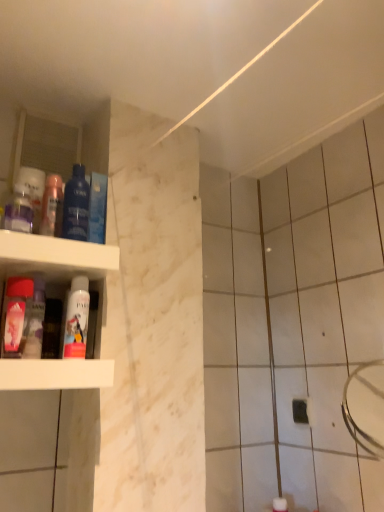
Question: Are translucent plastic mouthwash at upper left, the third mouthwash positioned from the left, and pink matte spray can at lower left, acting as the 2th mouthwash starting from the right, located far from each other?

Choices:
 (A) no
 (B) yes

Answer: (A)

Question: Considering the relative sizes of translucent plastic mouthwash at upper left, placed as the fourth mouthwash when sorted from right to left, and pink matte spray can at lower left, acting as the 2th mouthwash starting from the right, in the image provided, is translucent plastic mouthwash at upper left, placed as the fourth mouthwash when sorted from right to left, smaller than pink matte spray can at lower left, acting as the 2th mouthwash starting from the right,?

Choices:
 (A) yes
 (B) no

Answer: (B)

Question: Is translucent plastic mouthwash at upper left, placed as the fourth mouthwash when sorted from right to left, positioned with its back to pink matte spray can at lower left, the fifth mouthwash in the left-to-right sequence?

Choices:
 (A) yes
 (B) no

Answer: (B)

Question: Is translucent plastic mouthwash at upper left, the third mouthwash positioned from the left, located outside pink matte spray can at lower left, acting as the 2th mouthwash starting from the right?

Choices:
 (A) no
 (B) yes

Answer: (B)

Question: From a real-world perspective, is translucent plastic mouthwash at upper left, the third mouthwash positioned from the left, under pink matte spray can at lower left, acting as the 2th mouthwash starting from the right?

Choices:
 (A) no
 (B) yes

Answer: (A)

Question: From the image's perspective, would you say translucent plastic mouthwash at upper left, placed as the fourth mouthwash when sorted from right to left, is shown under pink matte spray can at lower left, the fifth mouthwash in the left-to-right sequence?

Choices:
 (A) no
 (B) yes

Answer: (A)

Question: Is translucent plastic mouthwash at left, arranged as the second mouthwash when viewed from the left, positioned with its back to blue glossy mouthwash at upper left, which is the 6th mouthwash from left to right?

Choices:
 (A) no
 (B) yes

Answer: (A)

Question: Can you confirm if translucent plastic mouthwash at left, placed as the 5th mouthwash when sorted from right to left, is thinner than blue glossy mouthwash at upper left, the 1th mouthwash positioned from the right?

Choices:
 (A) no
 (B) yes

Answer: (B)

Question: Is translucent plastic mouthwash at left, arranged as the second mouthwash when viewed from the left, in contact with blue glossy mouthwash at upper left, the 1th mouthwash positioned from the right?

Choices:
 (A) no
 (B) yes

Answer: (A)

Question: From the image's perspective, does translucent plastic mouthwash at left, arranged as the second mouthwash when viewed from the left, appear higher than blue glossy mouthwash at upper left, which is the 6th mouthwash from left to right?

Choices:
 (A) no
 (B) yes

Answer: (A)

Question: Would you say translucent plastic mouthwash at left, arranged as the second mouthwash when viewed from the left, contains blue glossy mouthwash at upper left, the 1th mouthwash positioned from the right?

Choices:
 (A) no
 (B) yes

Answer: (A)

Question: Is translucent plastic mouthwash at left, placed as the 5th mouthwash when sorted from right to left, oriented towards blue glossy mouthwash at upper left, which is the 6th mouthwash from left to right?

Choices:
 (A) no
 (B) yes

Answer: (A)

Question: From a real-world perspective, is blue glossy mouthwash at left, the third mouthwash in the right-to-left sequence, under blue glossy mouthwash at upper left, which is the 6th mouthwash from left to right?

Choices:
 (A) no
 (B) yes

Answer: (A)